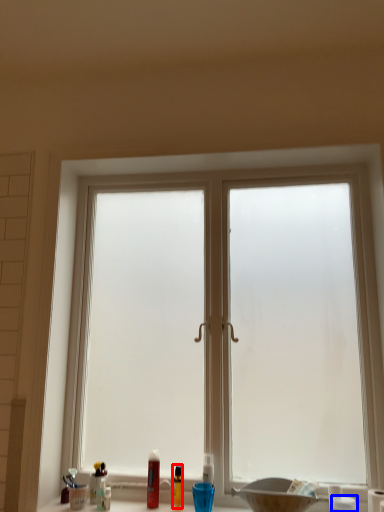
Question: Which object appears farthest to the camera in this image, toiletry (highlighted by a red box) or toiletry (highlighted by a blue box)?

Choices:
 (A) toiletry
 (B) toiletry

Answer: (A)